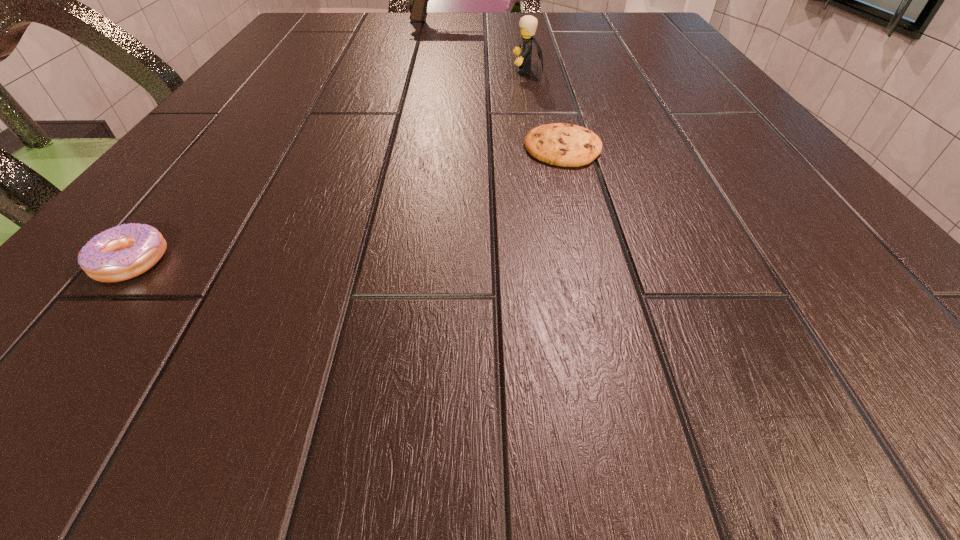
Find the location of a particular element. The height and width of the screenshot is (540, 960). free space between the second shortest object and the Lego is located at coordinates (329, 166).

Identify the location of blank region between the shortest object and the doughnut. (347, 204).

This screenshot has height=540, width=960. I want to click on object that ranks as the second closest to the Lego, so click(420, 0).

Find the location of a particular element. Image resolution: width=960 pixels, height=540 pixels. the third closest object to the cookie is located at coordinates (420, 0).

The image size is (960, 540). Find the location of `free spot that satisfies the following two spatial constraints: 1. at the muzzle of the farthest object; 2. on the back side of the third farthest object`. free spot that satisfies the following two spatial constraints: 1. at the muzzle of the farthest object; 2. on the back side of the third farthest object is located at coordinates (419, 147).

Find the location of `vacant position in the image that satisfies the following two spatial constraints: 1. on the back side of the cookie; 2. on the right side of the third tallest object`. vacant position in the image that satisfies the following two spatial constraints: 1. on the back side of the cookie; 2. on the right side of the third tallest object is located at coordinates (221, 147).

Where is `free space that satisfies the following two spatial constraints: 1. on the back side of the shortest object; 2. on the front-facing side of the Lego`? Image resolution: width=960 pixels, height=540 pixels. free space that satisfies the following two spatial constraints: 1. on the back side of the shortest object; 2. on the front-facing side of the Lego is located at coordinates (543, 70).

You are a GUI agent. You are given a task and a screenshot of the screen. Output one action in this format:
    pyautogui.click(x=<x>, y=<y>)
    Task: Click on the free location that satisfies the following two spatial constraints: 1. at the muzzle of the pistol; 2. on the front side of the leftmost object
    
    Given the screenshot: What is the action you would take?
    pyautogui.click(x=397, y=261)